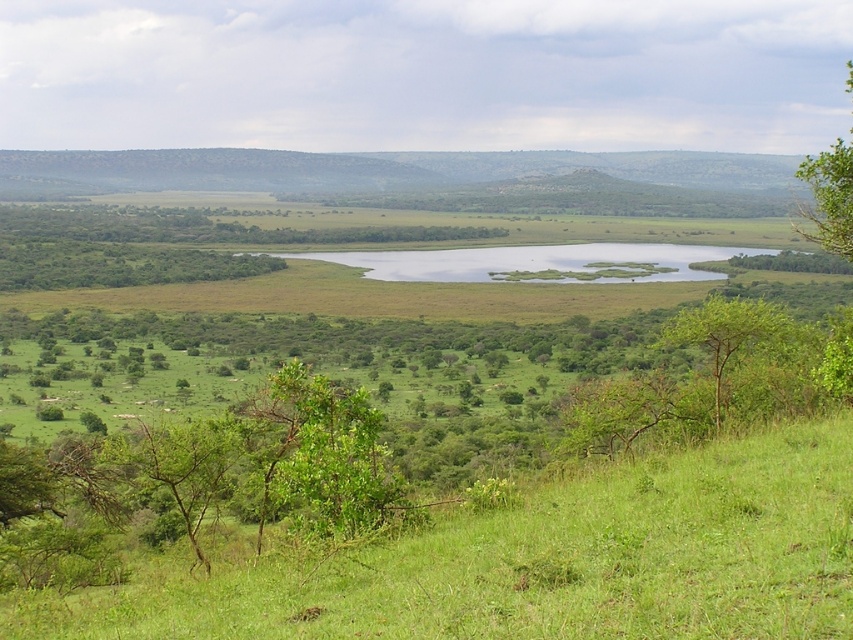
From the picture: You are standing in the serene landscape and want to walk from the point closer to you to the point further away. Which path would you take between the two points, point (381, 509) and point (633, 244)?

The path from point (381, 509) to point (633, 244) requires moving away from the viewer since point (381, 509) is closer to you than point (633, 244).

You are standing in the middle of the grassy area and want to walk towards the green leafy tree at lower right. Which direction should you walk to reach it first without passing by the green leafy tree at center?

The green leafy tree at center is closer to you than the green leafy tree at lower right. To reach the green leafy tree at lower right first without passing by the green leafy tree at center, you should walk towards the lower right direction directly, as the tree at center is in front but not blocking the path to the lower right tree.